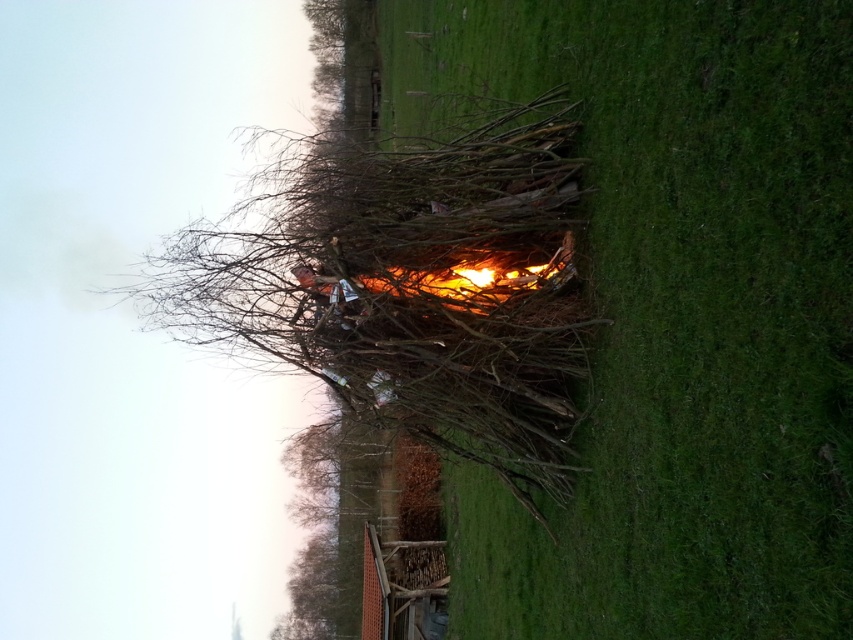
You are standing in the grassy field and want to approach the flaming wood at center. Which direction should you move relative to the green grass at center to get closer to the flames?

Since the green grass at center is closer to the viewer than the flaming wood at center, you should move forward towards the green grass at center to get closer to the flaming wood at center.

Consider the image. You are a fire safety inspector assessing the bonfire. You notice the bare branches at center and the flaming wood at center. What is the minimum safe distance required between these two to prevent the fire from spreading? Is the current distance sufficient?

The minimum safe distance required between the bare branches at center and the flaming wood at center is typically 36 inches. The current distance of 30.07 inches is insufficient to prevent the fire from spreading.